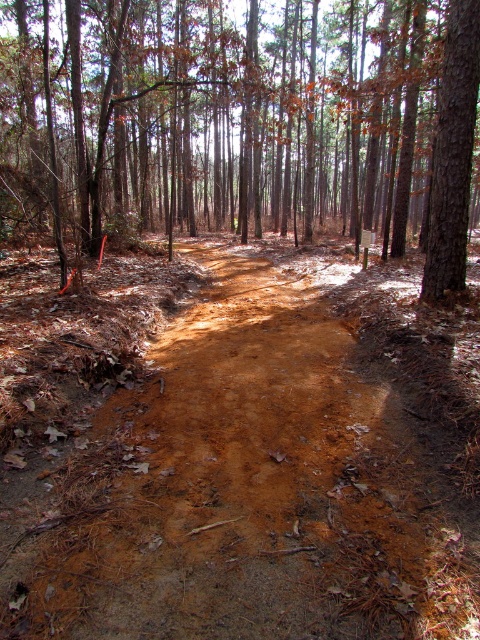
From the picture: Is brown bark tree at center positioned at the back of brown rough tree at upper right?

No, it is not.

In order to click on brown bark tree at center in this screenshot , I will do `click(243, 122)`.

Where is `brown bark tree at center`? brown bark tree at center is located at coordinates (243, 122).

Locate an element on the screen. Image resolution: width=480 pixels, height=640 pixels. brown sandy dirt track at center is located at coordinates 249,490.

The image size is (480, 640). Find the location of `brown sandy dirt track at center`. brown sandy dirt track at center is located at coordinates (249, 490).

Who is higher up, brown sandy dirt track at center or brown bark tree at center?

brown bark tree at center

Who is more distant from viewer, (276, 301) or (411, 58)?

The point (411, 58) is more distant.

You are a GUI agent. You are given a task and a screenshot of the screen. Output one action in this format:
    pyautogui.click(x=<x>, y=<y>)
    Task: Click on the brown sandy dirt track at center
    The height and width of the screenshot is (640, 480).
    Given the screenshot: What is the action you would take?
    pyautogui.click(x=249, y=490)

The width and height of the screenshot is (480, 640). In order to click on brown sandy dirt track at center in this screenshot , I will do `click(249, 490)`.